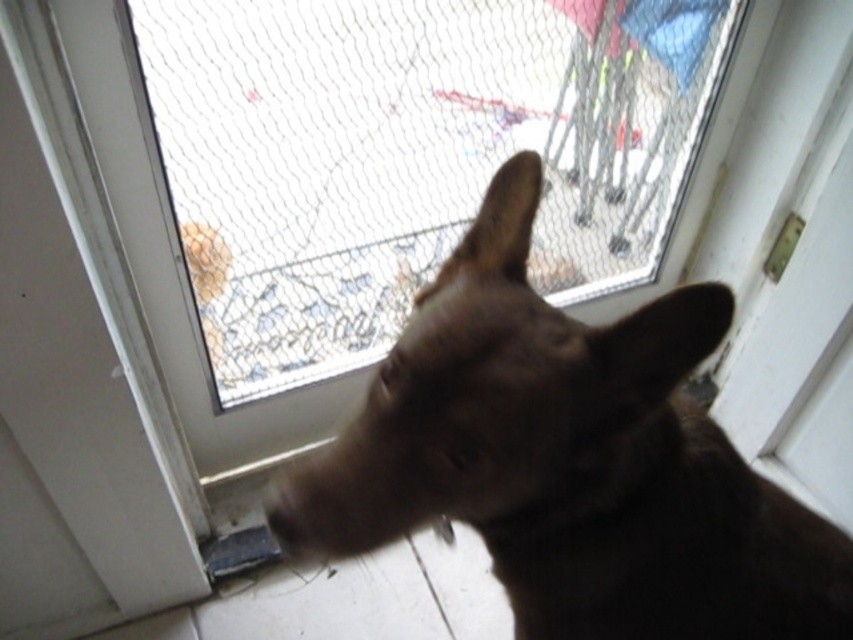
You are standing inside a house and see a screen door with a point marked at coordinates (409, 154). What is located at that point on the screen door?

The point at (409, 154) on the screen door indicates transparent mesh at upper center.

You are a delivery person trying to see through the transparent mesh at upper center to check if the brown fur dog at center is blocking the delivery drop spot. Can you see the dog through the mesh?

The transparent mesh at upper center is located above the brown fur dog at center, so you can see the dog through the mesh as it is positioned below the mesh.